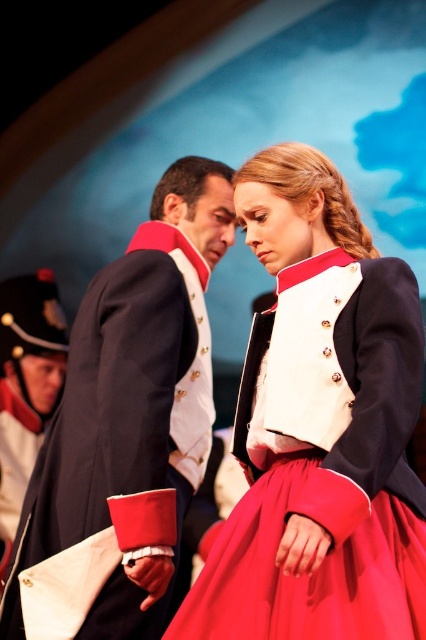
Who is shorter, matte black jacket at center or navy blue uniform at center?

matte black jacket at center

Is point (287, 611) farther from camera compared to point (28, 556)?

No, (287, 611) is closer to viewer.

In order to click on matte black jacket at center in this screenshot , I will do `click(319, 428)`.